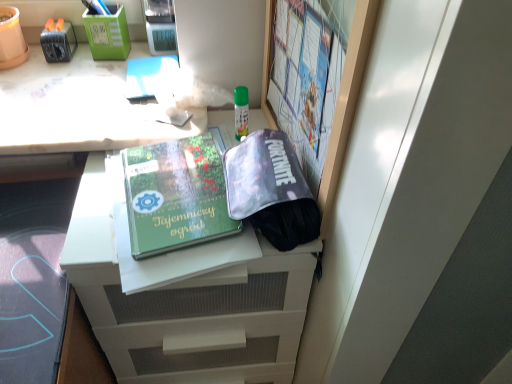
Question: From a real-world perspective, is green matte book at center beneath white glossy desk at upper left?

Choices:
 (A) yes
 (B) no

Answer: (B)

Question: From the image's perspective, is green matte book at center under white glossy desk at upper left?

Choices:
 (A) yes
 (B) no

Answer: (A)

Question: Is green matte book at center beside white glossy desk at upper left?

Choices:
 (A) yes
 (B) no

Answer: (B)

Question: From a real-world perspective, is green matte book at center physically above white glossy desk at upper left?

Choices:
 (A) no
 (B) yes

Answer: (B)

Question: Is green matte book at center to the left of white glossy desk at upper left from the viewer's perspective?

Choices:
 (A) no
 (B) yes

Answer: (A)

Question: Based on their sizes in the image, would you say white matte file cabinet at center is bigger or smaller than green plastic pen holder at upper left, which is counted as the second stationery, starting from the left?

Choices:
 (A) small
 (B) big

Answer: (B)

Question: Relative to green plastic pen holder at upper left, which is counted as the second stationery, starting from the left, is white matte file cabinet at center in front or behind?

Choices:
 (A) front
 (B) behind

Answer: (A)

Question: From the image's perspective, relative to green plastic pen holder at upper left, which is counted as the second stationery, starting from the left, is white matte file cabinet at center above or below?

Choices:
 (A) below
 (B) above

Answer: (A)

Question: Is point (222, 382) positioned closer to the camera than point (96, 36)?

Choices:
 (A) farther
 (B) closer

Answer: (B)

Question: In the image, is white matte file cabinet at center on the left side or the right side of green matte book at center?

Choices:
 (A) left
 (B) right

Answer: (B)

Question: In terms of height, does white matte file cabinet at center look taller or shorter compared to green matte book at center?

Choices:
 (A) tall
 (B) short

Answer: (A)

Question: Looking at their shapes, would you say white matte file cabinet at center is wider or thinner than green matte book at center?

Choices:
 (A) thin
 (B) wide

Answer: (B)

Question: Is white matte file cabinet at center spatially inside green matte book at center, or outside of it?

Choices:
 (A) outside
 (B) inside

Answer: (A)

Question: Does point (110, 38) appear closer or farther from the camera than point (362, 18)?

Choices:
 (A) farther
 (B) closer

Answer: (A)

Question: Considering the positions of green plastic pen holder at upper left, which is counted as the second stationery, starting from the left, and matte plastic bulletin board at upper right in the image, is green plastic pen holder at upper left, which is counted as the second stationery, starting from the left, wider or thinner than matte plastic bulletin board at upper right?

Choices:
 (A) thin
 (B) wide

Answer: (B)